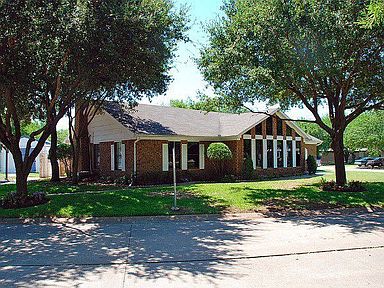
This screenshot has height=288, width=384. Identify the location of shutter. (252, 157).